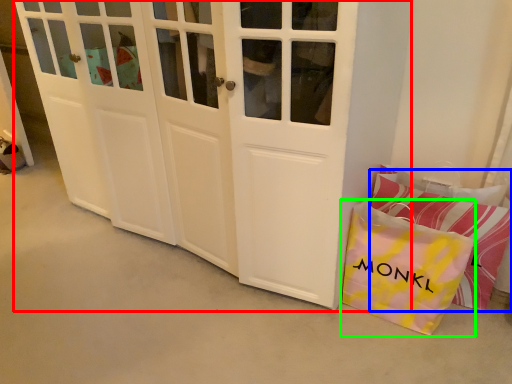
Question: Which object is positioned farthest from door (highlighted by a red box)? Select from pillow (highlighted by a blue box) and gift bag (highlighted by a green box).

Choices:
 (A) pillow
 (B) gift bag

Answer: (A)